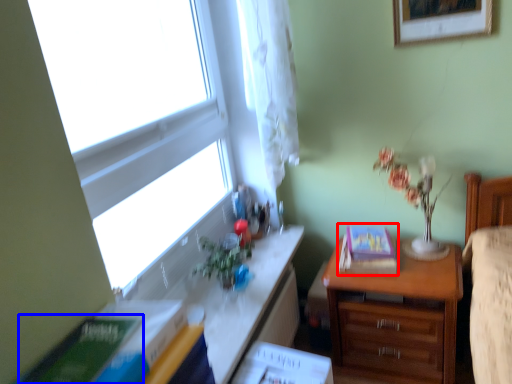
Question: Which object appears farthest to the camera in this image, paperback book (highlighted by a red box) or paperback book (highlighted by a blue box)?

Choices:
 (A) paperback book
 (B) paperback book

Answer: (A)